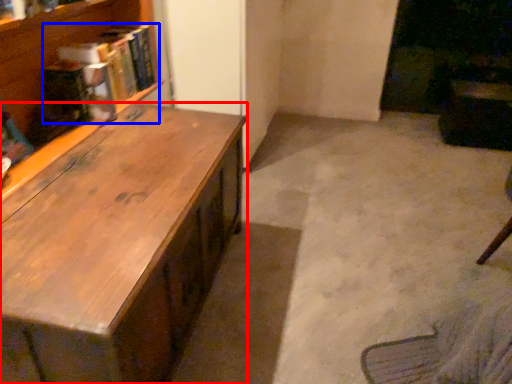
Question: Which of the following is the closest to the observer, desk (highlighted by a red box) or book (highlighted by a blue box)?

Choices:
 (A) desk
 (B) book

Answer: (A)